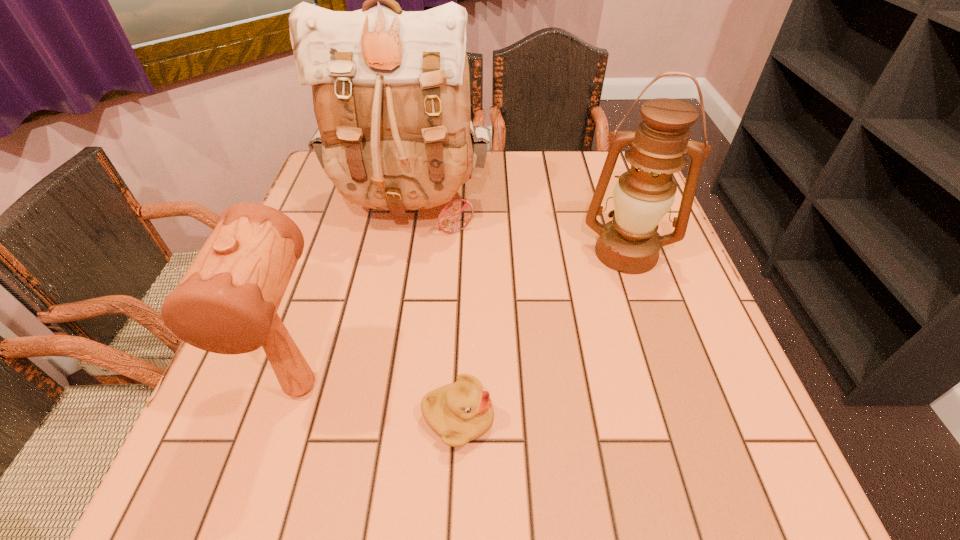
Identify the location of free space at the right edge. (649, 302).

Locate an element on the screen. free space at the far right corner of the desktop is located at coordinates (576, 150).

In the image, there is a desktop. At what (x,y) coordinates should I click in order to perform the action: click on vacant space at the near right corner. Please return your answer as a coordinate pair (x, y). The height and width of the screenshot is (540, 960). Looking at the image, I should click on (753, 458).

The height and width of the screenshot is (540, 960). In order to click on vacant space in between the second shortest object and the shortest object in this screenshot , I will do coord(380,403).

Image resolution: width=960 pixels, height=540 pixels. What are the coordinates of `free space between the rightmost object and the backpack` in the screenshot? It's located at click(x=518, y=230).

In order to click on free point between the backpack and the third tallest object in this screenshot , I will do `click(355, 297)`.

Where is `free space between the backpack and the duckling`? This screenshot has height=540, width=960. free space between the backpack and the duckling is located at coordinates (434, 313).

You are a GUI agent. You are given a task and a screenshot of the screen. Output one action in this format:
    pyautogui.click(x=<x>, y=<y>)
    Task: Click on the free point between the shortest object and the third tallest object
    The image size is (960, 540).
    Given the screenshot: What is the action you would take?
    pyautogui.click(x=380, y=403)

At what (x,y) coordinates should I click in order to perform the action: click on empty location between the second tallest object and the backpack. Please return your answer as a coordinate pair (x, y). This screenshot has height=540, width=960. Looking at the image, I should click on (518, 230).

I want to click on vacant space that's between the backpack and the shortest object, so click(x=434, y=313).